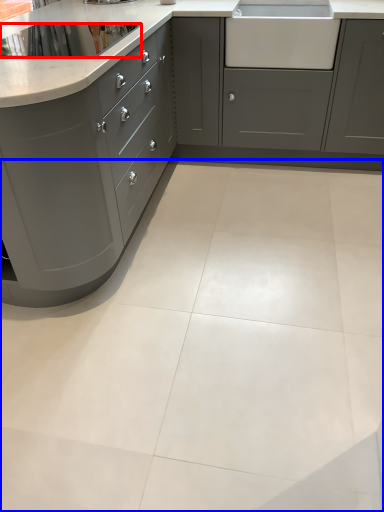
Question: Which object is further to the camera taking this photo, appliance (highlighted by a red box) or ceramic tile (highlighted by a blue box)?

Choices:
 (A) appliance
 (B) ceramic tile

Answer: (A)